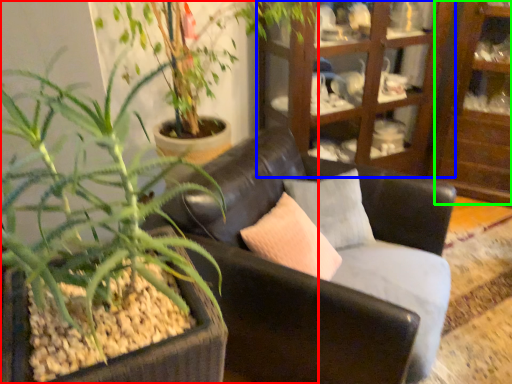
Question: Estimate the real-world distances between objects in this image. Which object is closer to houseplant (highlighted by a red box), cabinetry (highlighted by a blue box) or shelf (highlighted by a green box)?

Choices:
 (A) cabinetry
 (B) shelf

Answer: (A)